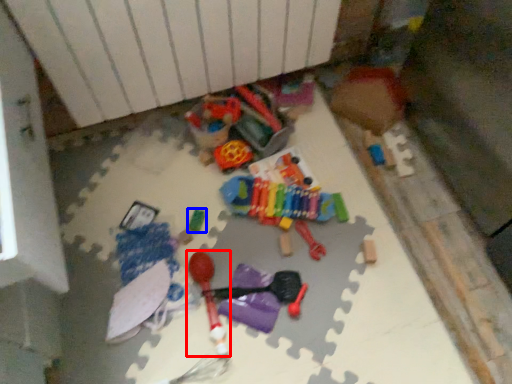
Question: Which object appears closest to the camera in this image, toy (highlighted by a red box) or toy (highlighted by a blue box)?

Choices:
 (A) toy
 (B) toy

Answer: (A)